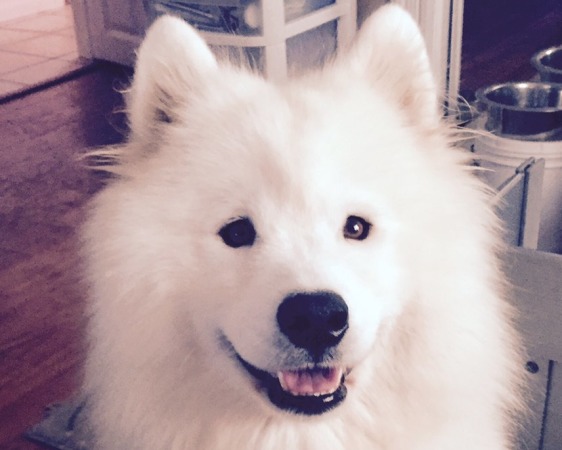
At what (x,y) coordinates should I click in order to perform the action: click on tiles. Please return your answer as a coordinate pair (x, y). Looking at the image, I should click on (36, 19), (35, 39), (43, 66), (15, 54), (17, 30).